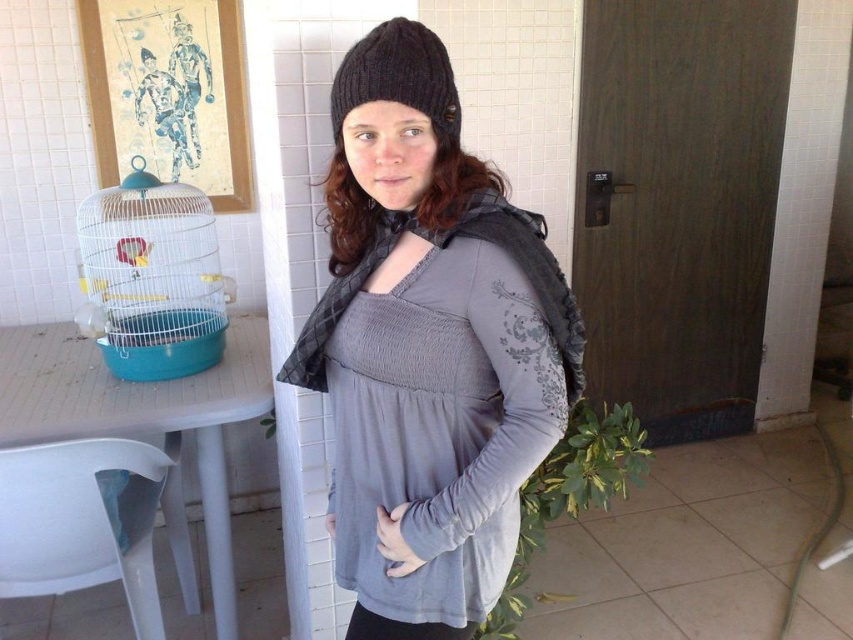
You are an interior designer assessing the layout of this room. You need to place a new sofa that requires a clear path to the entrance. The entrance is located behind the blue wire birdcage at left. Considering the black knitted beanie at upper center is worn by the person in the image, which object is closer to you, the observer, and might block the path?

The blue wire birdcage at left is closer to you than the black knitted beanie at upper center, so it might block the path to the entrance.

You are a person who needs to sit down. You are standing in the room and see the white plastic table with a birdcage on it and the point labeled as point (91,522). Where is the closest place to sit?

The point labeled (91,522) corresponds to the white plastic chair at lower left, so the closest place to sit is the white plastic chair at lower left.